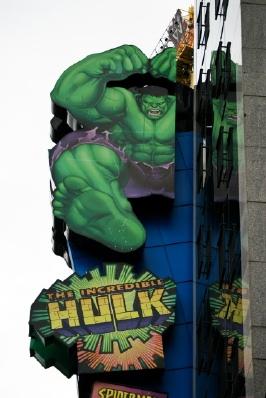
Identify the location of tile. (259, 313), (259, 231).